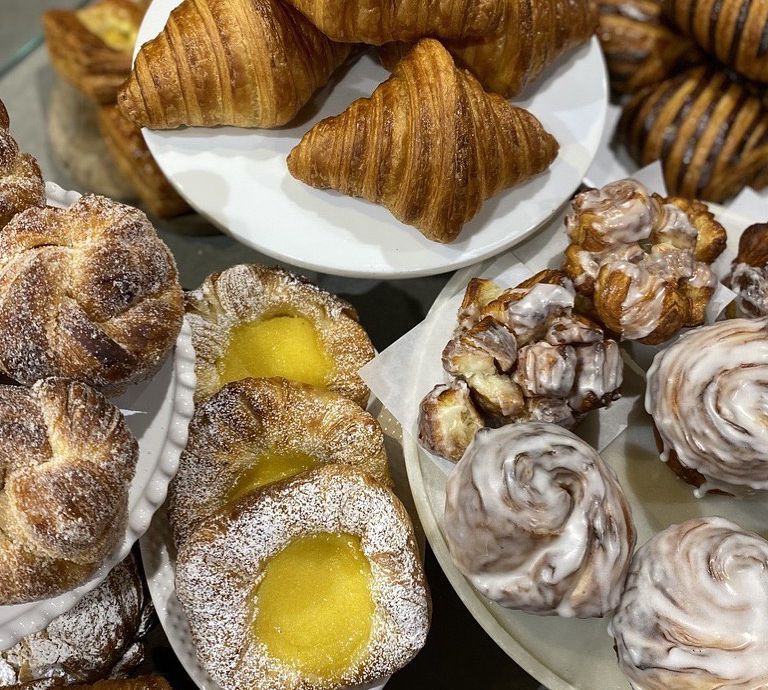
This screenshot has height=690, width=768. I want to click on cake plate, so click(576, 130).